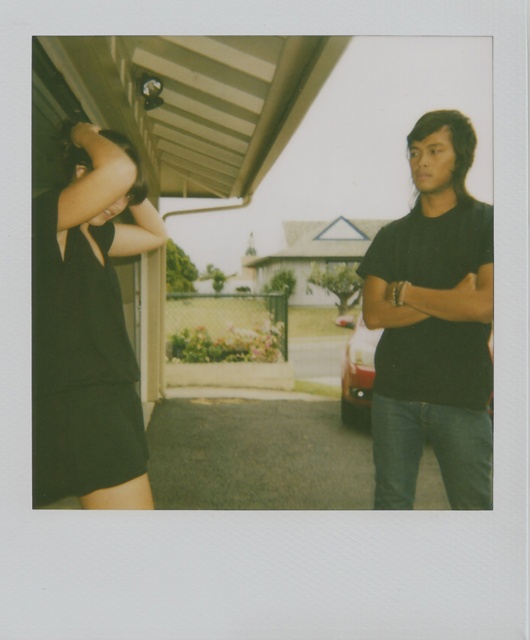
You are standing at the origin point of the image. Which of the two points, point (x=430, y=250) or point (x=357, y=332), is closer to you?

Point (x=430, y=250) is in front of point (x=357, y=332), so it is closer to you.